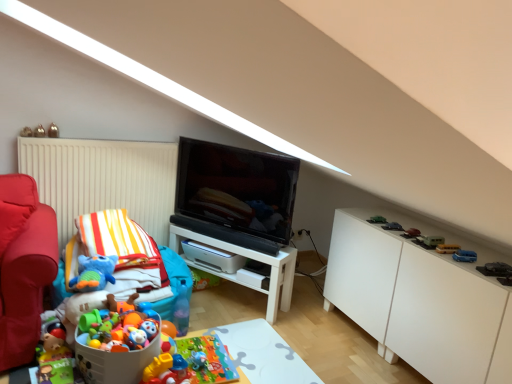
Question: Visually, is green matte toy car at right, which appears as the 9th toy when viewed from the left, positioned to the left or to the right of matte black tv at center?

Choices:
 (A) right
 (B) left

Answer: (A)

Question: Considering the positions of point (418, 238) and point (249, 178), is point (418, 238) closer or farther from the camera than point (249, 178)?

Choices:
 (A) closer
 (B) farther

Answer: (A)

Question: Based on their relative distances, which object is farther from the green matte toy car at right, which appears as the 9th toy when viewed from the left?

Choices:
 (A) blue plastic toy car at lower right, the 5th toy ordered from the bottom
 (B) white matte table at center, the second table in the bottom-to-top sequence
 (C) metallic gold toy at upper left, the twelfth toy when ordered from right to left
 (D) shiny red car at right, which is counted as the fifth toy, starting from the right
 (E) matte red sofa at left

Answer: (C)

Question: Which is nearer to the white matte table at center, the second table in the bottom-to-top sequence?

Choices:
 (A) plush toy at lower left, the 2th toy positioned from the bottom
 (B) metallic silver car at upper right, the 6th toy viewed from the right
 (C) green matte toy car at right, which is the 6th toy from top to bottom
 (D) green matte toy car at right, positioned as the 7th toy in right-to-left order
 (E) shiny red car at right, which is counted as the fifth toy, starting from the right

Answer: (D)